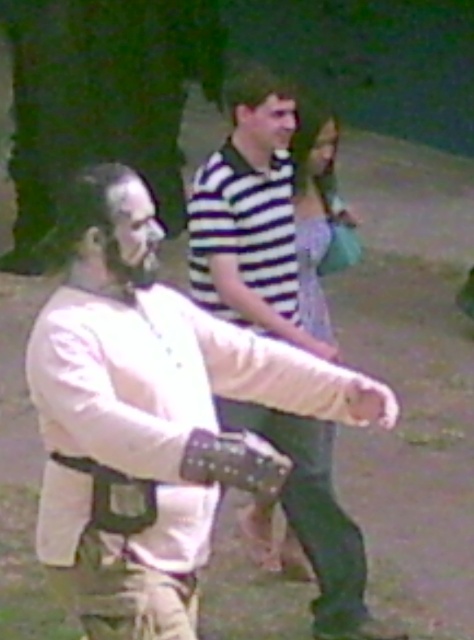
Question: Estimate the real-world distances between objects in this image. Which object is closer to the striped cotton shirt at center?

Choices:
 (A) matte striped shirt at upper center
 (B) smooth skin face at center
 (C) white leather armor at center
 (D) matte white mask at center

Answer: (B)

Question: Which of the following is the farthest from the observer?

Choices:
 (A) matte striped shirt at upper center
 (B) matte white mask at center
 (C) striped cotton shirt at center

Answer: (A)

Question: Which object is the closest to the matte white mask at center?

Choices:
 (A) white leather armor at center
 (B) striped cotton shirt at center

Answer: (A)

Question: In this image, where is smooth skin face at center located relative to matte striped shirt at upper center?

Choices:
 (A) left
 (B) right

Answer: (A)

Question: Is striped cotton shirt at center above smooth skin face at center?

Choices:
 (A) no
 (B) yes

Answer: (A)

Question: Is smooth skin face at center to the right of matte striped shirt at upper center from the viewer's perspective?

Choices:
 (A) no
 (B) yes

Answer: (A)